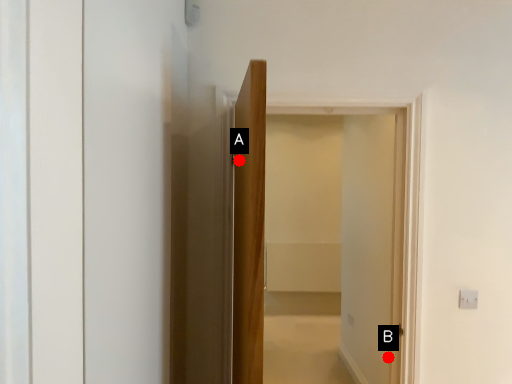
Question: Two points are circled on the image, labeled by A and B beside each circle. Which point appears farthest from the camera in this image?

Choices:
 (A) A is further
 (B) B is further

Answer: (B)